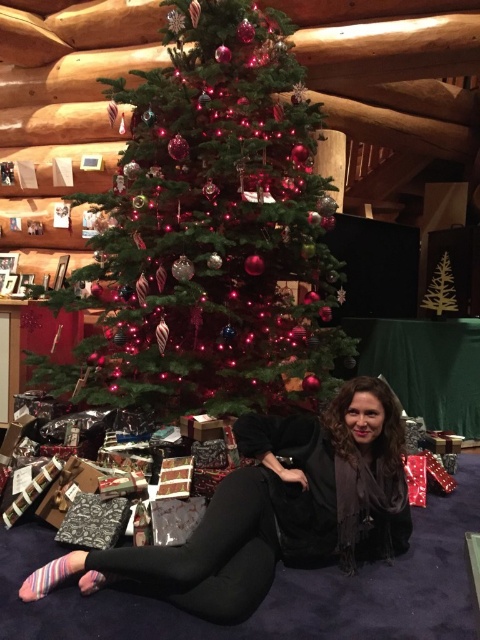
Question: Which point appears closest to the camera in this image?

Choices:
 (A) (276, 419)
 (B) (168, 86)

Answer: (A)

Question: Among these points, which one is nearest to the camera?

Choices:
 (A) (348, 396)
 (B) (115, 115)

Answer: (A)

Question: Is shiny green christmas tree at center in front of black leggings at lower center?

Choices:
 (A) no
 (B) yes

Answer: (A)

Question: Can you confirm if shiny green christmas tree at center is bigger than black leggings at lower center?

Choices:
 (A) yes
 (B) no

Answer: (A)

Question: Observing the image, what is the correct spatial positioning of shiny green christmas tree at center in reference to black leggings at lower center?

Choices:
 (A) right
 (B) left

Answer: (B)